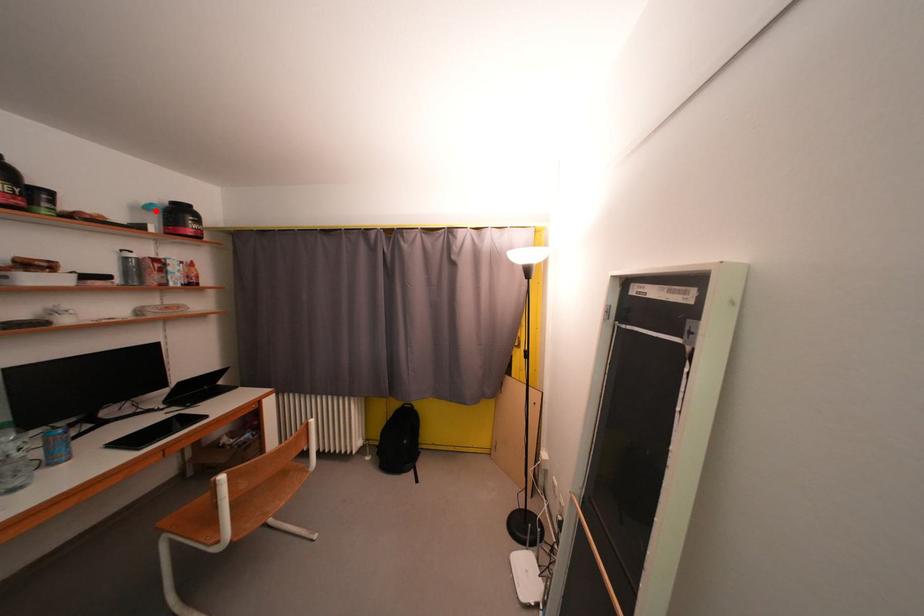
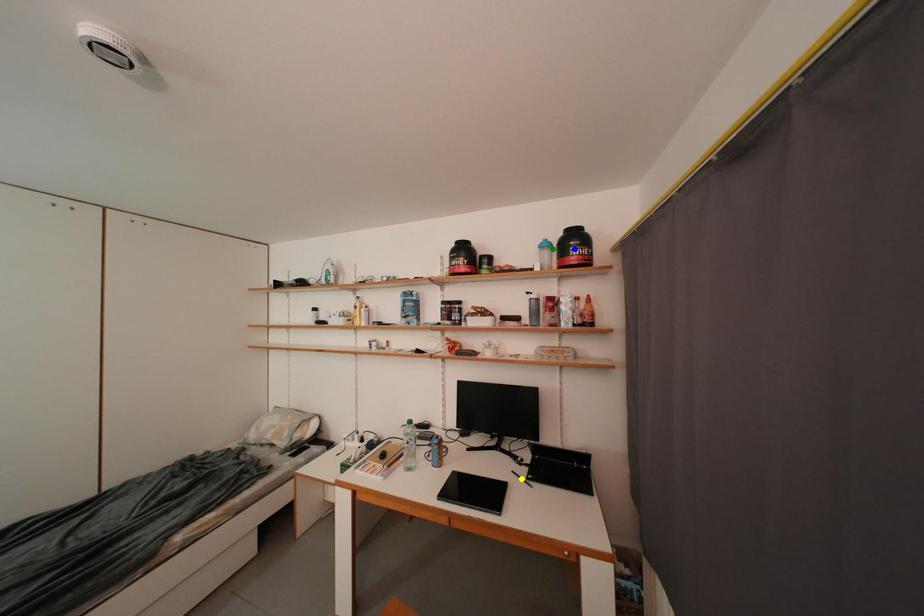
Question: I am providing you with two images of the same scene from different viewpoints. A red point is marked on the first image. You are given multiple points on the second image. Which spot in image 2 lines up with the point in image 1?

Choices:
 (A) green point
 (B) yellow point
 (C) blue point

Answer: (A)